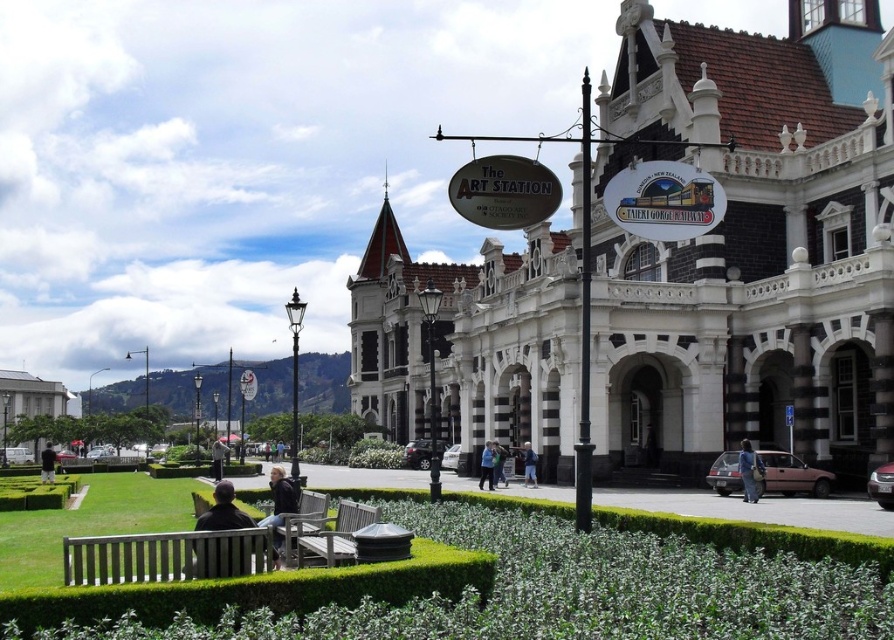
You are a visitor at The ART STATION and want to park your matte pink car at lower right. There is a wooden bench at center nearby. Considering the space available, can your car fit in the parking spot next to the bench without overlapping it?

The matte pink car at lower right is wider than the wooden bench at center. Since the car is wider, it may not fit in the parking spot next to the bench without overlapping it, depending on the total available space.

You are standing in front of The ART STATION and notice a matte pink car at lower right and a dark gray jacket at center. Which object is positioned higher up in the image?

The matte pink car at lower right is above the dark gray jacket at center, so it is positioned higher up in the image.

You are a visitor arriving at The ART STATION and need to park your matte pink car at lower right. There is a wooden bench at center nearby. Can your car fit in the parking space where the bench is located?

The matte pink car at lower right is larger than the wooden bench at center. Since the bench is placed where the parking space is, the car may not fit if the space is sized for objects of the bench size.